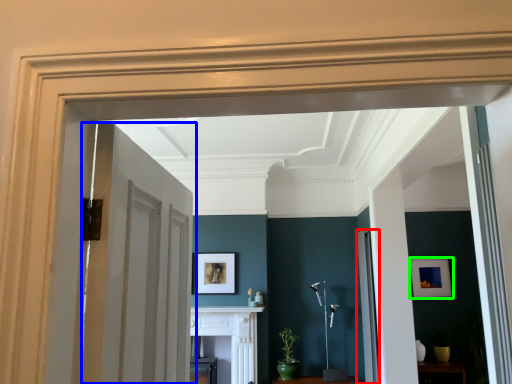
Question: Estimate the real-world distances between objects in this image. Which object is closer to door (highlighted by a red box), door (highlighted by a blue box) or picture frame (highlighted by a green box)?

Choices:
 (A) door
 (B) picture frame

Answer: (B)